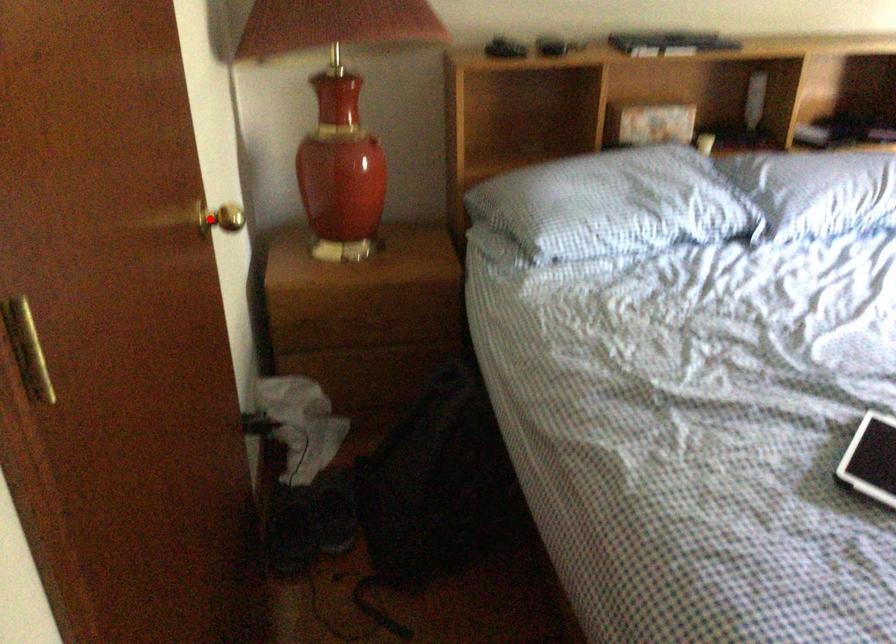
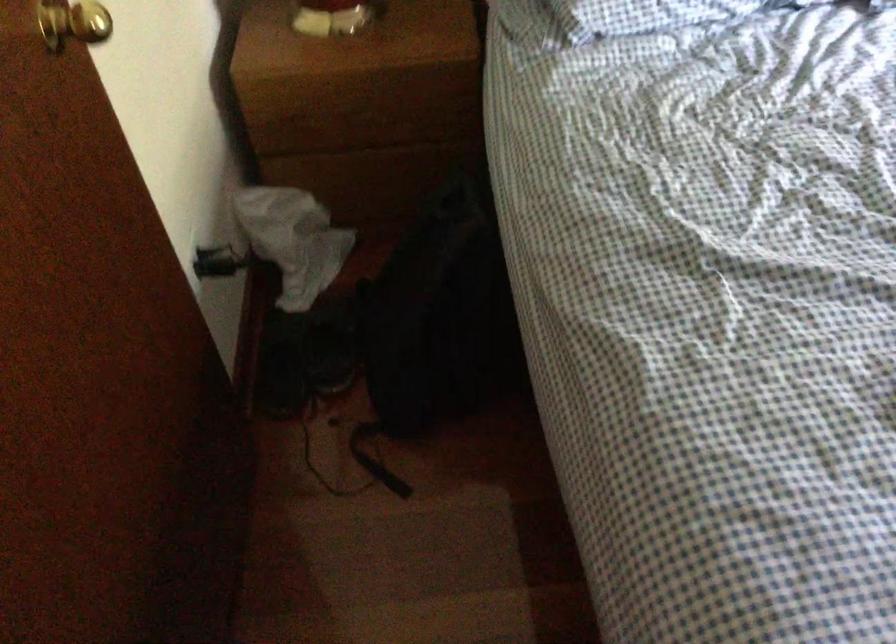
Question: I am providing you with two images of the same scene from different viewpoints. Image1 has a red point marked. In image2, the corresponding 3D location appears at what relative position? Reply with the corresponding letter.

Choices:
 (A) Closer
 (B) Farther

Answer: (A)